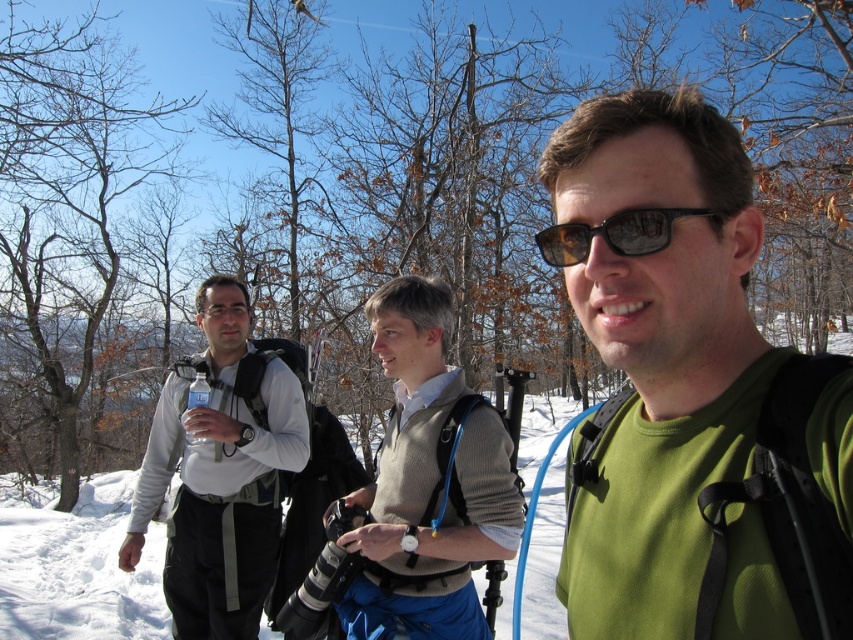
Question: Is knit sweater at center to the left of white matte water bottle at left from the viewer's perspective?

Choices:
 (A) yes
 (B) no

Answer: (B)

Question: Does green matte shirt at center have a greater width compared to black reflective sunglasses at center?

Choices:
 (A) yes
 (B) no

Answer: (A)

Question: Considering the relative positions of green matte shirt at center and black reflective sunglasses at center in the image provided, where is green matte shirt at center located with respect to black reflective sunglasses at center?

Choices:
 (A) below
 (B) above

Answer: (A)

Question: Which point is closer to the camera?

Choices:
 (A) knit sweater at center
 (B) black reflective sunglasses at center
 (C) white matte water bottle at left

Answer: (B)

Question: Which of the following is the farthest from the observer?

Choices:
 (A) [x=805, y=394]
 (B) [x=180, y=404]
 (C) [x=579, y=230]
 (D) [x=463, y=572]

Answer: (B)

Question: Which point is closer to the camera?

Choices:
 (A) white matte water bottle at left
 (B) black reflective sunglasses at center
 (C) green matte shirt at center

Answer: (C)